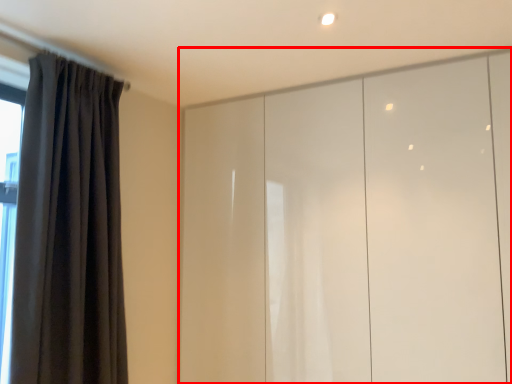
Question: Observing the image, what is the correct spatial positioning of cupboard (annotated by the red box) in reference to curtain?

Choices:
 (A) left
 (B) right

Answer: (B)